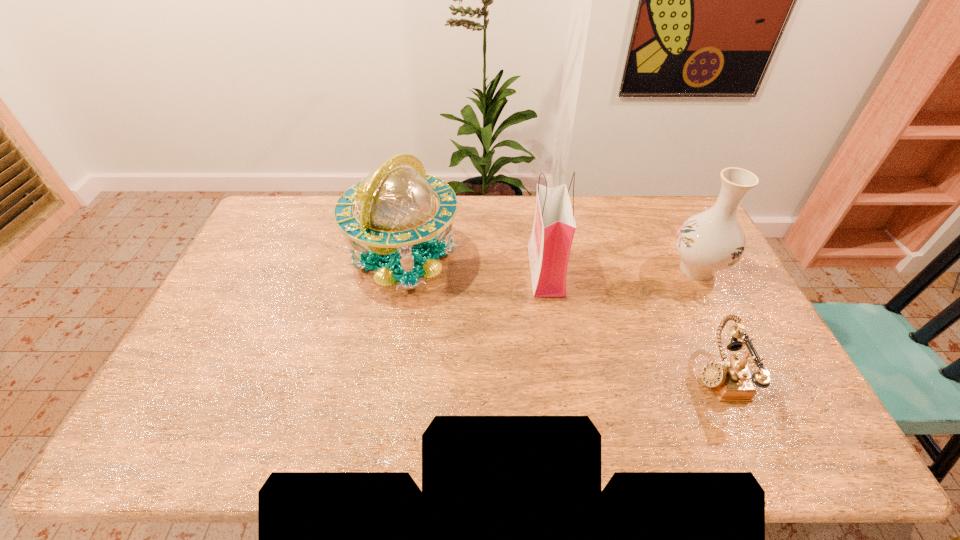
This screenshot has height=540, width=960. Identify the location of empty location between the third object from right to left and the shortest object. (633, 322).

Locate which object is the third closest to the leftmost object. Please provide its 2D coordinates. Your answer should be formatted as a tuple, i.e. [(x, y)], where the tuple contains the x and y coordinates of a point satisfying the conditions above.

[(710, 241)]

Choose which object is the second nearest neighbor to the vase. Please provide its 2D coordinates. Your answer should be formatted as a tuple, i.e. [(x, y)], where the tuple contains the x and y coordinates of a point satisfying the conditions above.

[(549, 247)]